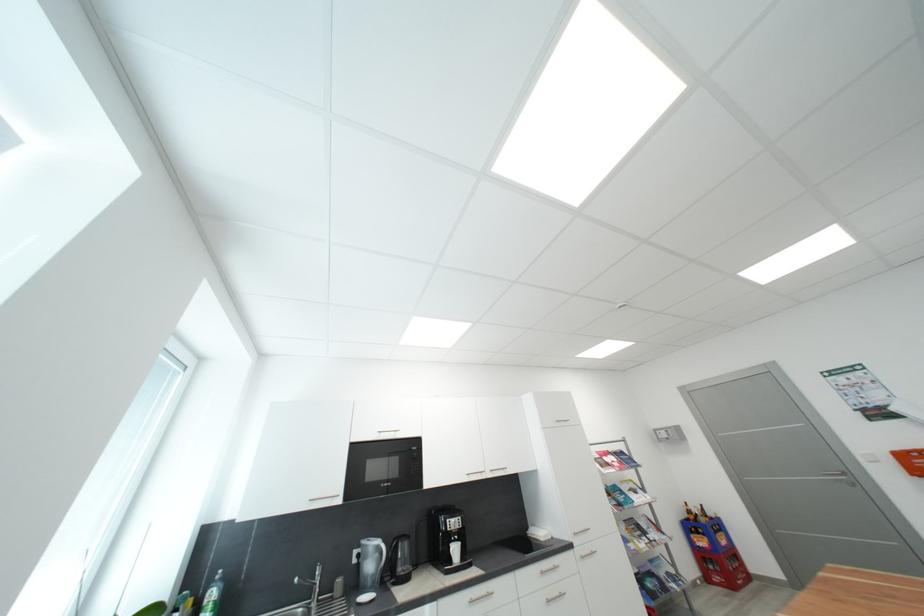
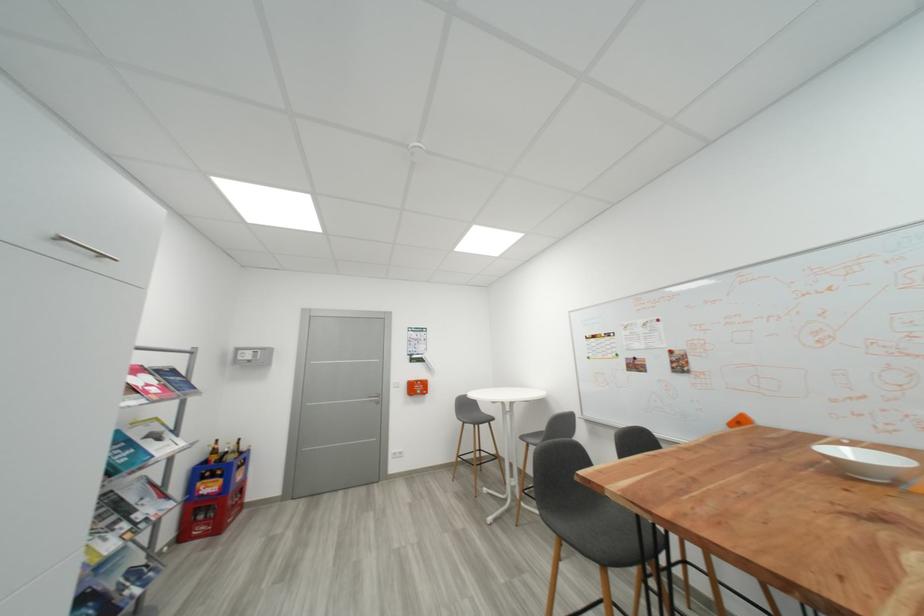
In the second image, find the point that corresponds to (714,581) in the first image.

(189, 538)